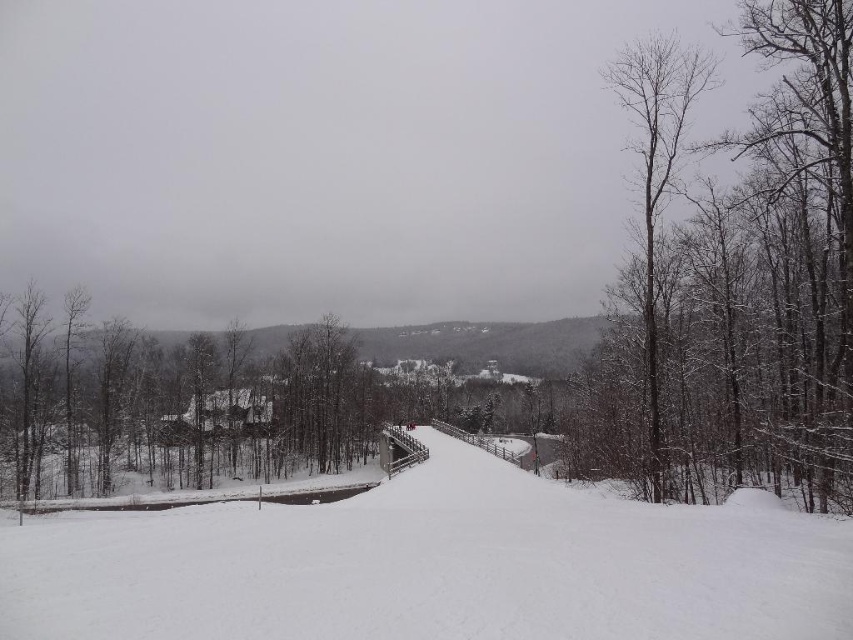
Question: Which point appears farthest from the camera in this image?

Choices:
 (A) (366, 634)
 (B) (665, 156)

Answer: (B)

Question: Does snow-covered bare tree at right have a larger size compared to bare wood tree at right?

Choices:
 (A) yes
 (B) no

Answer: (A)

Question: Which object appears farthest from the camera in this image?

Choices:
 (A) white snow ski slope at center
 (B) bare wood tree at right
 (C) snow-covered bare tree at right

Answer: (B)

Question: Can you confirm if snow-covered bare tree at right is bigger than bare wood tree at right?

Choices:
 (A) yes
 (B) no

Answer: (A)

Question: In this image, where is white snow ski slope at center located relative to snow-covered bare tree at right?

Choices:
 (A) right
 (B) left

Answer: (B)

Question: Which object appears farthest from the camera in this image?

Choices:
 (A) white snow ski slope at center
 (B) bare wood tree at right
 (C) snow-covered bare tree at right

Answer: (B)